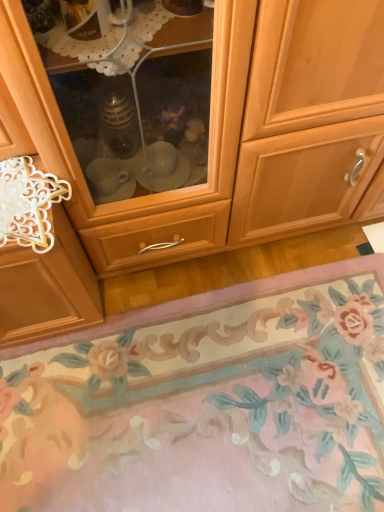
Where is `vacant space situated above floral carpet at lower center (from a real-world perspective)`? Image resolution: width=384 pixels, height=512 pixels. vacant space situated above floral carpet at lower center (from a real-world perspective) is located at coordinates (208, 398).